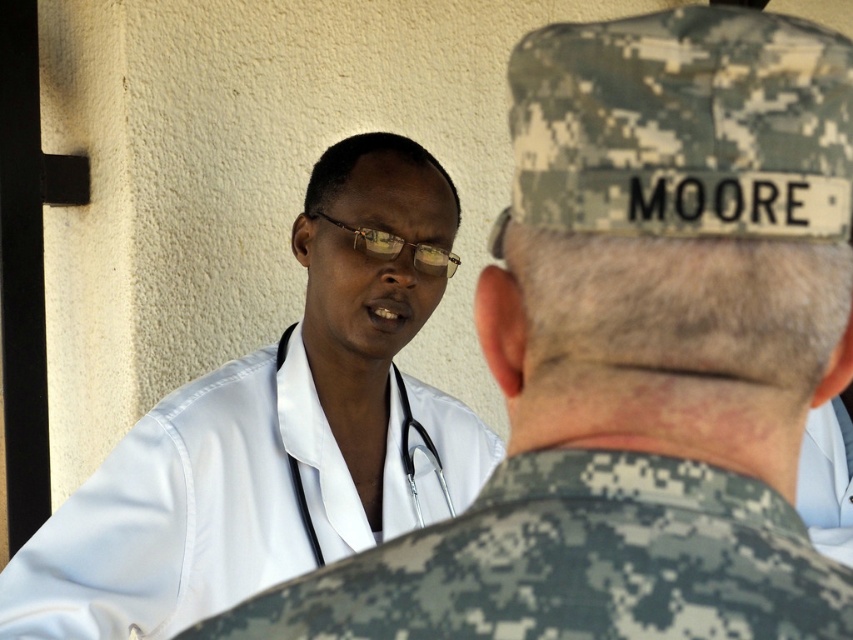
Question: Among these objects, which one is farthest from the camera?

Choices:
 (A) digital camouflage uniform at center
 (B) white smooth lab coat at upper left

Answer: (B)

Question: Can you confirm if digital camouflage uniform at center is positioned to the right of white smooth lab coat at upper left?

Choices:
 (A) yes
 (B) no

Answer: (A)

Question: Can you confirm if digital camouflage uniform at center is smaller than metallic silver stethoscope at center?

Choices:
 (A) no
 (B) yes

Answer: (B)

Question: Which point appears closest to the camera in this image?

Choices:
 (A) (749, 582)
 (B) (415, 484)
 (C) (247, 467)

Answer: (A)

Question: Does digital camouflage uniform at center appear under white smooth lab coat at upper left?

Choices:
 (A) yes
 (B) no

Answer: (B)

Question: Which of the following is the closest to the observer?

Choices:
 (A) digital camouflage uniform at center
 (B) metallic silver stethoscope at center

Answer: (A)